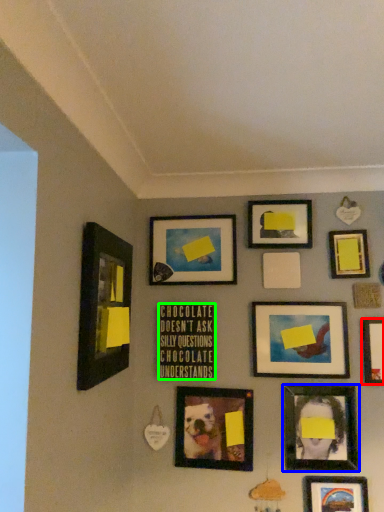
Question: Estimate the real-world distances between objects in this image. Which object is farther from picture frame (highlighted by a red box), picture frame (highlighted by a blue box) or picture frame (highlighted by a green box)?

Choices:
 (A) picture frame
 (B) picture frame

Answer: (B)